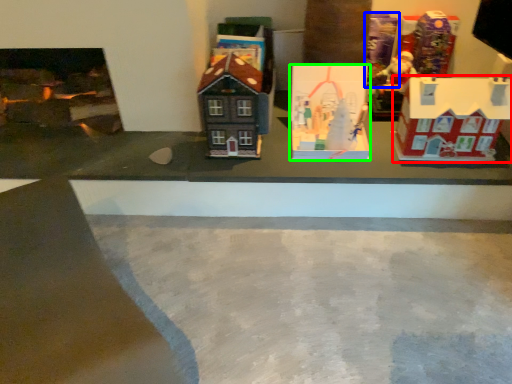
Question: Which object is positioned farthest from toy (highlighted by a red box)? Select from toy (highlighted by a blue box) and toy (highlighted by a green box).

Choices:
 (A) toy
 (B) toy

Answer: (A)